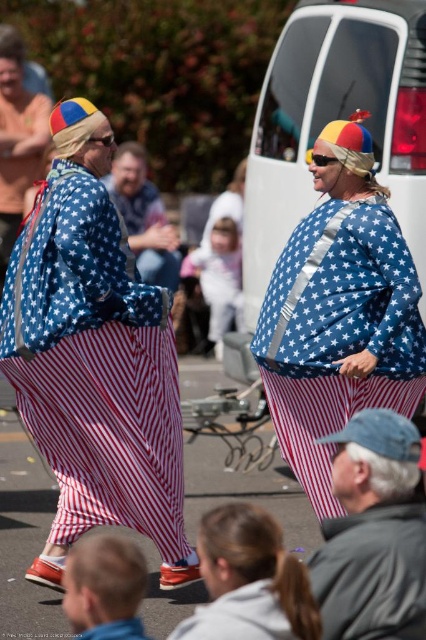
You are a photographer standing at the center of the scene, and you want to take a photo that includes both the blonde hair at lower left and the blue denim jeans at center. Given that your camera has a maximum focus range of 35 feet, will you be able to capture both subjects in focus?

The blonde hair at lower left is 37.47 feet away from blue denim jeans at center. Since the distance between them exceeds the camera maximum focus range of 35 feet, you won between the two subjects exceeds the camera maximum focus range of 35 feet, so you won between the two subjects exceeds the camera maximum focus range of 35 feet, so you will not be able to capture both subjects in focus.

Consider the image. You are a photographer at this event and want to capture a photo that includes both the blonde hair at lower left and the blue denim jeans at center. Which object should you adjust your camera focus on to ensure both are in the same focal plane?

You should focus on the blue denim jeans at center because the blonde hair at lower left is closer to the viewer than the blue denim jeans at center, so adjusting focus to the farther object ensures both are in focus.